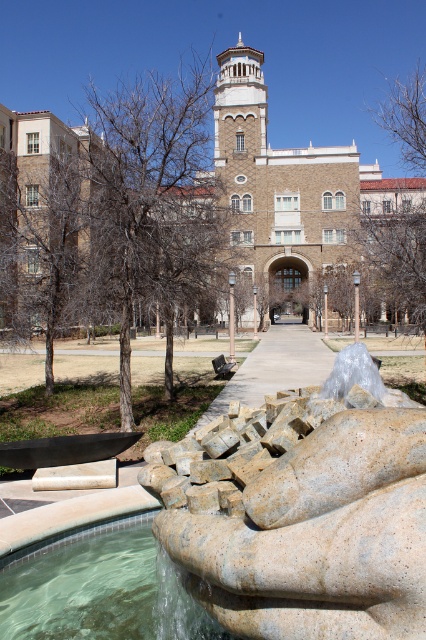
Does bare wood tree at left appear under brown textured tree at center?

No.

Is bare wood tree at left thinner than brown textured tree at center?

Correct, bare wood tree at left's width is less than brown textured tree at center's.

Between point (25, 250) and point (371, 250), which one is positioned behind?

The point (371, 250) is behind.

The height and width of the screenshot is (640, 426). Identify the location of bare wood tree at left. (40, 244).

Is granite fountain at lower center below bare wood tree at left?

Yes.

Does point (319, 548) come farther from viewer compared to point (25, 323)?

No, it is not.

Find the location of a particular element. granite fountain at lower center is located at coordinates (317, 536).

Which is more to the right, granite fountain at lower center or clear stone fountain at lower left?

From the viewer's perspective, granite fountain at lower center appears more on the right side.

Is granite fountain at lower center closer to camera compared to clear stone fountain at lower left?

Yes, it is in front of clear stone fountain at lower left.

Between point (267, 605) and point (131, 582), which one is positioned behind?

The point (131, 582) is more distant.

Image resolution: width=426 pixels, height=640 pixels. What are the coordinates of `granite fountain at lower center` in the screenshot? It's located at (317, 536).